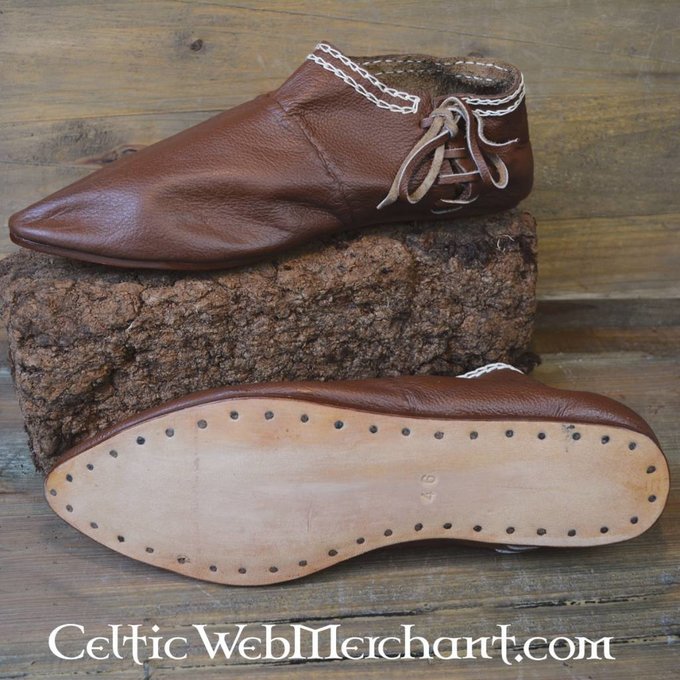
Locate an element on the screen. The height and width of the screenshot is (680, 680). table is located at coordinates (562, 211).